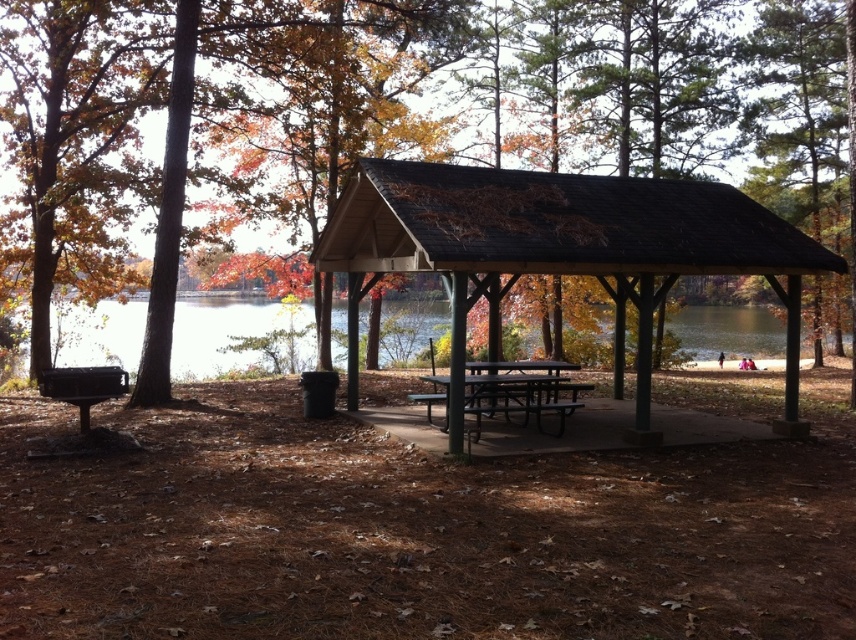
Question: Does brown wood gazebo at center appear on the left side of clear water at center?

Choices:
 (A) no
 (B) yes

Answer: (A)

Question: Which point is closer to the camera taking this photo?

Choices:
 (A) (502, 372)
 (B) (450, 381)
 (C) (84, 394)
 (D) (214, 317)

Answer: (B)

Question: Which of the following is the farthest from the observer?

Choices:
 (A) brown wood gazebo at center
 (B) wooden picnic table at lower left

Answer: (A)

Question: Which point is farther to the camera?

Choices:
 (A) (45, 381)
 (B) (259, 310)

Answer: (B)

Question: Does brown wood tree at center appear on the right side of black metal picnic table at center?

Choices:
 (A) yes
 (B) no

Answer: (A)

Question: Can you confirm if brown wood gazebo at center is bigger than clear water at center?

Choices:
 (A) yes
 (B) no

Answer: (B)